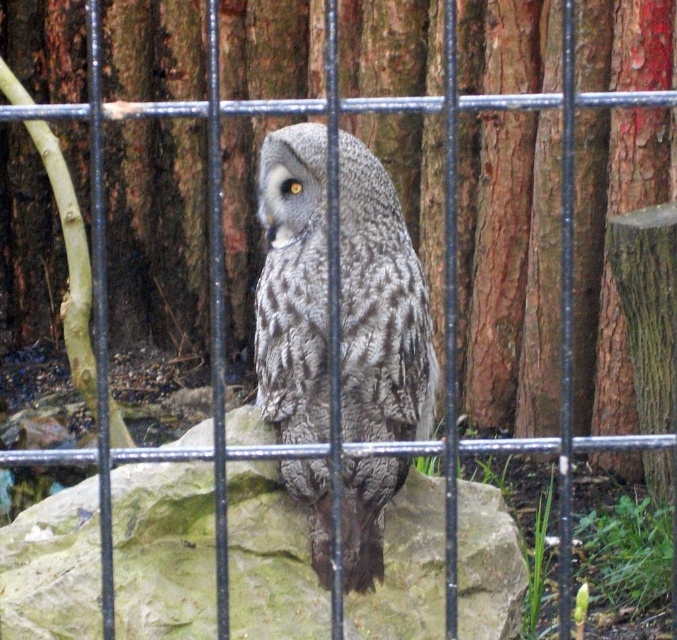
You are a zookeeper standing at the entrance of the enclosure. You need to place a food bowl exactly at the same position as the gray rough stone at center. What are the 2D coordinates where you should place the bowl?

The gray rough stone at center is located at 2D coordinates point (162, 550), so the food bowl should be placed at the same coordinates.

You are a zookeeper who needs to clean the enclosure. The gray rough stone at center is part of the exhibit and must remain in place. Since the gray textured owl at center is perched on it, can you safely remove the stone without disturbing the owl?

The gray rough stone at center is positioned under the gray textured owl at center, so you cannot safely remove the stone without disturbing the owl because the owl is perched on top of it.

You are a zookeeper trying to clean the enclosure. You need to reach both the point at coordinates point (240, 545) and point (309, 284). Which point should you clean first if you want to clean the one that is closer to the entrance without moving around the enclosure?

You should clean point (309, 284) first because it is in front of point (240, 545), making it closer to the entrance.